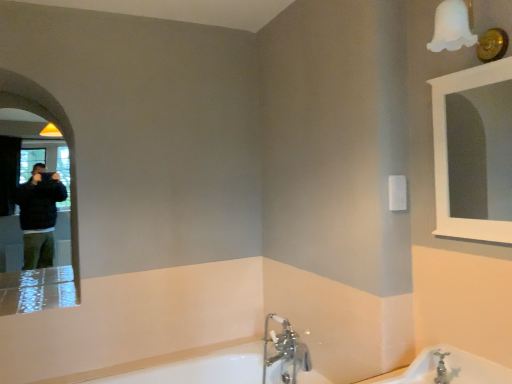
The image size is (512, 384). What do you see at coordinates (220, 369) in the screenshot?
I see `white glossy bathtub at lower center, arranged as the 1th bath when ordered from the bottom` at bounding box center [220, 369].

What is the approximate width of matte black mirror at left, the 2th mirror when ordered from front to back?

matte black mirror at left, the 2th mirror when ordered from front to back, is 25.12 inches in width.

Find the location of a particular element. The image size is (512, 384). white frosted glass light fixture at upper right is located at coordinates (465, 32).

You are a GUI agent. You are given a task and a screenshot of the screen. Output one action in this format:
    pyautogui.click(x=<x>, y=<y>)
    Task: Click on the chrome metallic faucet at lower center
    This screenshot has width=512, height=384.
    Given the screenshot: What is the action you would take?
    click(x=285, y=350)

Based on the photo, what is the approximate height of chrome metallic faucet at lower center?

The height of chrome metallic faucet at lower center is 18.30 inches.

The width and height of the screenshot is (512, 384). I want to click on white glossy bathtub at lower center, which ranks as the first bath in back-to-front order, so click(220, 369).

Can you tell me how much white glossy bathtub at lower center, positioned as the second bath in right-to-left order, and white porcelain bathtub at lower right, positioned as the 1th bath in front-to-back order, differ in facing direction?

white glossy bathtub at lower center, positioned as the second bath in right-to-left order, and white porcelain bathtub at lower right, positioned as the 1th bath in front-to-back order, are facing 89.7 degrees away from each other.

Choose the correct answer: Is white glossy bathtub at lower center, which ranks as the first bath in back-to-front order, inside white porcelain bathtub at lower right, positioned as the 1th bath in front-to-back order, or outside it?

white glossy bathtub at lower center, which ranks as the first bath in back-to-front order, is spatially situated outside white porcelain bathtub at lower right, positioned as the 1th bath in front-to-back order.

Is white glossy bathtub at lower center, placed as the 1th bath when sorted from left to right, taller than white porcelain bathtub at lower right, the 2th bath in the bottom-to-top sequence?

Indeed, white glossy bathtub at lower center, placed as the 1th bath when sorted from left to right, has a greater height compared to white porcelain bathtub at lower right, the 2th bath in the bottom-to-top sequence.

Between point (210, 380) and point (476, 372), which one is positioned behind?

The point (210, 380) is farther from the camera.

Considering the relative sizes of matte black mirror at left, which appears as the first mirror when viewed from the back, and chrome metallic faucet at lower center in the image provided, is matte black mirror at left, which appears as the first mirror when viewed from the back, wider than chrome metallic faucet at lower center?

Indeed, matte black mirror at left, which appears as the first mirror when viewed from the back, has a greater width compared to chrome metallic faucet at lower center.

From the image's perspective, which one is positioned higher, matte black mirror at left, the first mirror when ordered from left to right, or chrome metallic faucet at lower center?

matte black mirror at left, the first mirror when ordered from left to right, from the image's perspective.

Which is behind, point (48, 117) or point (293, 371)?

The point (48, 117) is behind.

Is matte black mirror at left, the first mirror when ordered from left to right, to the left of chrome metallic faucet at lower center from the viewer's perspective?

Yes, matte black mirror at left, the first mirror when ordered from left to right, is to the left of chrome metallic faucet at lower center.

There is a white porcelain bathtub at lower right, the 2th bath viewed from the back. Identify the location of light fixture above it (from a real-world perspective). Image resolution: width=512 pixels, height=384 pixels. (465, 32).

From a real-world perspective, is white porcelain bathtub at lower right, the 2th bath viewed from the back, beneath white frosted glass light fixture at upper right?

Yes, from a real-world perspective, white porcelain bathtub at lower right, the 2th bath viewed from the back, is below white frosted glass light fixture at upper right.

Between white porcelain bathtub at lower right, the 2th bath viewed from the back, and white frosted glass light fixture at upper right, which one has smaller width?

white frosted glass light fixture at upper right is thinner.

Is white porcelain bathtub at lower right, arranged as the 2th bath when viewed from the left, turned away from white frosted glass light fixture at upper right?

No, white porcelain bathtub at lower right, arranged as the 2th bath when viewed from the left, is not facing the opposite direction of white frosted glass light fixture at upper right.

From the image's perspective, does white porcelain bathtub at lower right, arranged as the 2th bath when viewed from the left, appear lower than white glossy bathtub at lower center, arranged as the 1th bath when ordered from the bottom?

Actually, white porcelain bathtub at lower right, arranged as the 2th bath when viewed from the left, appears above white glossy bathtub at lower center, arranged as the 1th bath when ordered from the bottom, in the image.

Which is in front, white porcelain bathtub at lower right, arranged as the 2th bath when viewed from the left, or white glossy bathtub at lower center, arranged as the 2th bath when viewed from the front?

white porcelain bathtub at lower right, arranged as the 2th bath when viewed from the left.

Considering the sizes of objects white porcelain bathtub at lower right, the 2th bath viewed from the back, and white glossy bathtub at lower center, arranged as the 2th bath when viewed from the front, in the image provided, who is thinner, white porcelain bathtub at lower right, the 2th bath viewed from the back, or white glossy bathtub at lower center, arranged as the 2th bath when viewed from the front,?

Thinner between the two is white porcelain bathtub at lower right, the 2th bath viewed from the back.

Based on the photo, does white porcelain bathtub at lower right, arranged as the 2th bath when viewed from the left, have a lesser height compared to white glossy bathtub at lower center, which ranks as the first bath in back-to-front order?

Yes, white porcelain bathtub at lower right, arranged as the 2th bath when viewed from the left, is shorter than white glossy bathtub at lower center, which ranks as the first bath in back-to-front order.

In the scene shown: Measure the distance between white glossy bathtub at lower center, which ranks as the first bath in back-to-front order, and matte black mirror at left, the 2th mirror when ordered from front to back.

3.64 feet.

Consider the image. Is matte black mirror at left, the first mirror when ordered from left to right, at the back of white glossy bathtub at lower center, positioned as the second bath in right-to-left order?

No, white glossy bathtub at lower center, positioned as the second bath in right-to-left order,'s orientation is not away from matte black mirror at left, the first mirror when ordered from left to right.

Is white glossy bathtub at lower center, arranged as the 1th bath when ordered from the bottom, in front of or behind matte black mirror at left, acting as the 2th mirror starting from the right, in the image?

In the image, white glossy bathtub at lower center, arranged as the 1th bath when ordered from the bottom, appears in front of matte black mirror at left, acting as the 2th mirror starting from the right.

Based on the photo, who is taller, white glossy bathtub at lower center, arranged as the 1th bath when ordered from the bottom, or matte black mirror at left, the first mirror when ordered from left to right?

With more height is matte black mirror at left, the first mirror when ordered from left to right.

Would you say matte black mirror at left, the first mirror when ordered from left to right, is inside or outside white glossy mirror at upper right, acting as the second mirror starting from the back?

matte black mirror at left, the first mirror when ordered from left to right, cannot be found inside white glossy mirror at upper right, acting as the second mirror starting from the back.

Can you tell me how much matte black mirror at left, which appears as the first mirror when viewed from the back, and white glossy mirror at upper right, marked as the second mirror in a left-to-right arrangement, differ in facing direction?

89.6 degrees.

Between matte black mirror at left, the 2th mirror when ordered from front to back, and white glossy mirror at upper right, marked as the second mirror in a left-to-right arrangement, which one has larger size?

matte black mirror at left, the 2th mirror when ordered from front to back.

Measure the distance between matte black mirror at left, which appears as the first mirror when viewed from the back, and white glossy mirror at upper right, arranged as the 1th mirror when viewed from the right.

matte black mirror at left, which appears as the first mirror when viewed from the back, is 3.24 meters away from white glossy mirror at upper right, arranged as the 1th mirror when viewed from the right.

From a real-world perspective, which object rests below the other?

white porcelain bathtub at lower right, positioned as the 1th bath in front-to-back order, is physically lower.

Which of these two, white frosted glass light fixture at upper right or white porcelain bathtub at lower right, the 2th bath in the bottom-to-top sequence, is thinner?

Thinner between the two is white frosted glass light fixture at upper right.

Does white frosted glass light fixture at upper right come behind white porcelain bathtub at lower right, the 2th bath in the bottom-to-top sequence?

That is True.

Locate an element on the screen. Image resolution: width=512 pixels, height=384 pixels. bath above the white glossy bathtub at lower center, arranged as the 2th bath when viewed from the front (from a real-world perspective) is located at coordinates (446, 369).

From the image's perspective, which mirror is the 1st one above the chrome metallic faucet at lower center? Please provide its 2D coordinates.

[(55, 125)]

Which object lies further to the anchor point white frosted glass light fixture at upper right, white glossy bathtub at lower center, the 2th bath from the top, or white porcelain bathtub at lower right, the 2th bath viewed from the back?

white glossy bathtub at lower center, the 2th bath from the top.

From the image, which object appears to be farther from chrome metallic faucet at lower center, matte black mirror at left, the first mirror when ordered from left to right, or white glossy bathtub at lower center, arranged as the 1th bath when ordered from the bottom?

Among the two, matte black mirror at left, the first mirror when ordered from left to right, is located further to chrome metallic faucet at lower center.

Based on their spatial positions, is white porcelain bathtub at lower right, the 2th bath viewed from the back, or white frosted glass light fixture at upper right further from chrome metallic faucet at lower center?

white frosted glass light fixture at upper right lies further to chrome metallic faucet at lower center than the other object.

Looking at the image, which one is located closer to white glossy bathtub at lower center, arranged as the 1th bath when ordered from the bottom, white porcelain bathtub at lower right, the first bath from the top, or chrome metallic faucet at lower center?

chrome metallic faucet at lower center is closer to white glossy bathtub at lower center, arranged as the 1th bath when ordered from the bottom.

Based on their spatial positions, is white frosted glass light fixture at upper right or matte black mirror at left, which appears as the first mirror when viewed from the back, closer to white porcelain bathtub at lower right, the 2th bath in the bottom-to-top sequence?

The object closer to white porcelain bathtub at lower right, the 2th bath in the bottom-to-top sequence, is white frosted glass light fixture at upper right.

Which object lies further to the anchor point white glossy mirror at upper right, which is the first mirror in front-to-back order, white glossy bathtub at lower center, positioned as the second bath in right-to-left order, or matte black mirror at left, which appears as the first mirror when viewed from the back?

matte black mirror at left, which appears as the first mirror when viewed from the back.

Estimate the real-world distances between objects in this image. Which object is closer to white frosted glass light fixture at upper right, white glossy bathtub at lower center, the 2th bath from the top, or matte black mirror at left, the 2th mirror when ordered from front to back?

Among the two, white glossy bathtub at lower center, the 2th bath from the top, is located nearer to white frosted glass light fixture at upper right.

Considering their positions, is white glossy bathtub at lower center, positioned as the second bath in right-to-left order, positioned closer to matte black mirror at left, the 2th mirror when ordered from front to back, than white frosted glass light fixture at upper right?

Among the two, white glossy bathtub at lower center, positioned as the second bath in right-to-left order, is located nearer to matte black mirror at left, the 2th mirror when ordered from front to back.

In order to click on light fixture between matte black mirror at left, the 2th mirror when ordered from front to back, and white glossy mirror at upper right, marked as the second mirror in a left-to-right arrangement, from left to right in this screenshot , I will do `click(465, 32)`.

Where is `tap between matte black mirror at left, which appears as the first mirror when viewed from the back, and white glossy mirror at upper right, acting as the second mirror starting from the back`? The image size is (512, 384). tap between matte black mirror at left, which appears as the first mirror when viewed from the back, and white glossy mirror at upper right, acting as the second mirror starting from the back is located at coordinates (285, 350).

Identify the location of tap between matte black mirror at left, the 2th mirror when ordered from front to back, and white frosted glass light fixture at upper right, in the horizontal direction. This screenshot has width=512, height=384. (285, 350).

Identify the location of bath between white frosted glass light fixture at upper right and white glossy bathtub at lower center, the 2th bath from the top, vertically. Image resolution: width=512 pixels, height=384 pixels. (446, 369).